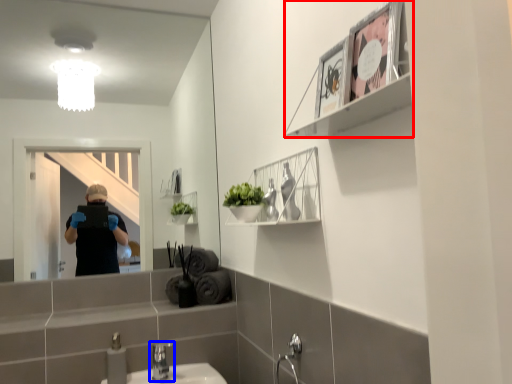
Question: Which object is closer to the camera taking this photo, cabinet (highlighted by a red box) or tap (highlighted by a blue box)?

Choices:
 (A) cabinet
 (B) tap

Answer: (A)